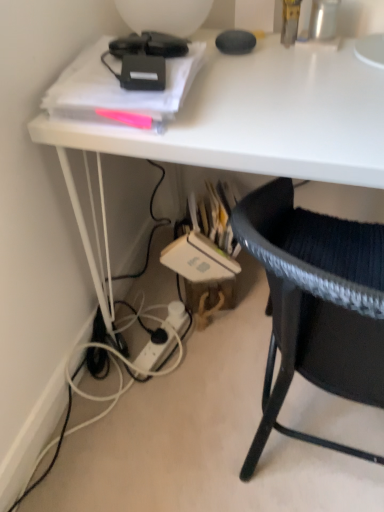
Question: Considering the relative sizes of white plastic power outlet at lower center and white glossy desk at upper center in the image provided, is white plastic power outlet at lower center wider than white glossy desk at upper center?

Choices:
 (A) no
 (B) yes

Answer: (A)

Question: Considering the relative sizes of white plastic power outlet at lower center and white glossy desk at upper center in the image provided, is white plastic power outlet at lower center shorter than white glossy desk at upper center?

Choices:
 (A) no
 (B) yes

Answer: (B)

Question: From the image's perspective, does white plastic power outlet at lower center appear higher than white glossy desk at upper center?

Choices:
 (A) no
 (B) yes

Answer: (A)

Question: Can you confirm if white plastic power outlet at lower center is positioned to the right of white glossy desk at upper center?

Choices:
 (A) yes
 (B) no

Answer: (B)

Question: Could white glossy desk at upper center be considered to be inside white plastic power outlet at lower center?

Choices:
 (A) yes
 (B) no

Answer: (B)

Question: Looking at the image, does white glossy desk at upper center seem bigger or smaller compared to white plastic power outlet at lower center?

Choices:
 (A) small
 (B) big

Answer: (B)

Question: From a real-world perspective, is white glossy desk at upper center physically located above or below white plastic power outlet at lower center?

Choices:
 (A) above
 (B) below

Answer: (A)

Question: Is point (319, 130) closer or farther from the camera than point (183, 304)?

Choices:
 (A) farther
 (B) closer

Answer: (B)

Question: Based on their positions, is white glossy desk at upper center located to the left or right of white plastic power outlet at lower center?

Choices:
 (A) right
 (B) left

Answer: (A)

Question: In the image, is black woven chair at lower right positioned in front of or behind white plastic power outlet at lower center?

Choices:
 (A) front
 (B) behind

Answer: (A)

Question: From the image's perspective, relative to white plastic power outlet at lower center, is black woven chair at lower right above or below?

Choices:
 (A) below
 (B) above

Answer: (B)

Question: Which is correct: black woven chair at lower right is inside white plastic power outlet at lower center, or outside of it?

Choices:
 (A) outside
 (B) inside

Answer: (A)

Question: Is point (372, 400) positioned closer to the camera than point (157, 353)?

Choices:
 (A) closer
 (B) farther

Answer: (A)

Question: In terms of size, does white glossy desk at upper center appear bigger or smaller than black woven chair at lower right?

Choices:
 (A) big
 (B) small

Answer: (A)

Question: From the image's perspective, is white glossy desk at upper center positioned above or below black woven chair at lower right?

Choices:
 (A) above
 (B) below

Answer: (A)